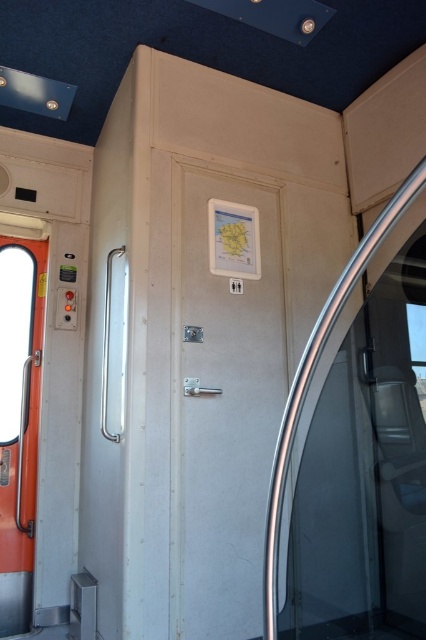
You are a passenger on the train and need to find the restroom. You see the white matte door at center and the transparent glass door at right. Which door should you go to?

The white matte door at center is to the left of transparent glass door at right. Since the restroom sign is above the white matte door at center, you should go to the white matte door at center.

You are a passenger on a train and need to find the restroom. You see two doors ahead of you, the white matte door at center and the transparent glass door at right. Which door is wider?

The white matte door at center is wider than the transparent glass door at right.

You are a passenger on a train and need to find the restroom. You see an orange glossy screen door at left and a transparent glass door at right. According to the scene description, which door should you go through to reach the restroom?

The orange glossy screen door at left is to the left of transparent glass door at right. Since the restroom sign is above the orange glossy screen door at left, you should go through the orange glossy screen door at left to reach the restroom.